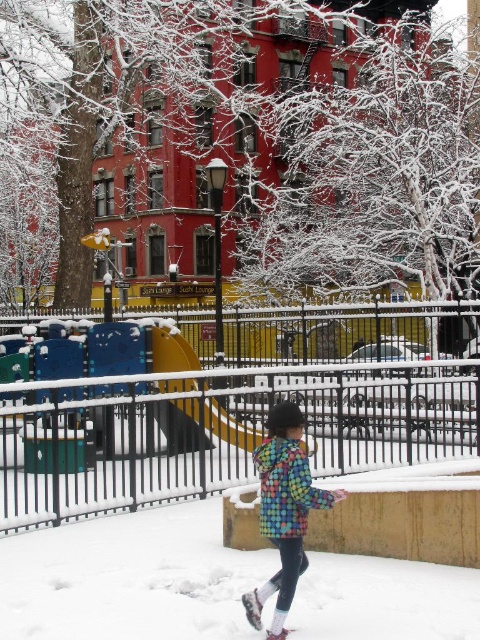
You are a photographer trying to capture the metallic black fence at center and the multicolored quilted jacket at center in the same frame. Based on their sizes, do you think both objects will fit in your camera viewfinder?

The metallic black fence at center might be wider than multicolored quilted jacket at center, so there is a possibility that both objects will fit in the camera viewfinder as long as the fence isn